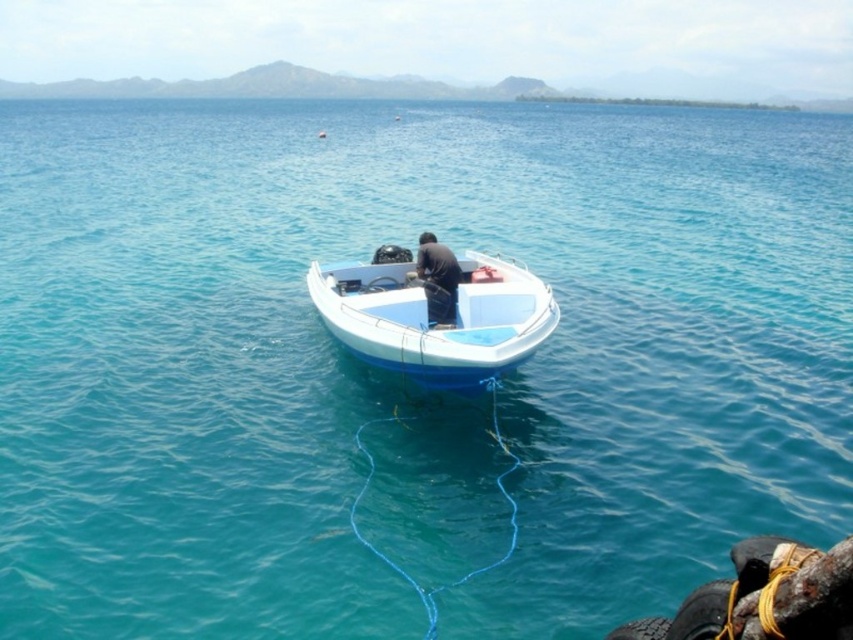
Question: Which point appears farthest from the camera in this image?

Choices:
 (A) (335, 321)
 (B) (440, 317)

Answer: (B)

Question: Which point is farther from the camera taking this photo?

Choices:
 (A) (434, 314)
 (B) (369, 276)

Answer: (B)

Question: Is white plastic boat at center above dark blue fabric at center?

Choices:
 (A) yes
 (B) no

Answer: (B)

Question: Is white plastic boat at center wider than dark blue fabric at center?

Choices:
 (A) yes
 (B) no

Answer: (A)

Question: Which point appears farthest from the camera in this image?

Choices:
 (A) (532, 321)
 (B) (434, 280)

Answer: (B)

Question: Does white plastic boat at center appear on the right side of dark blue fabric at center?

Choices:
 (A) yes
 (B) no

Answer: (B)